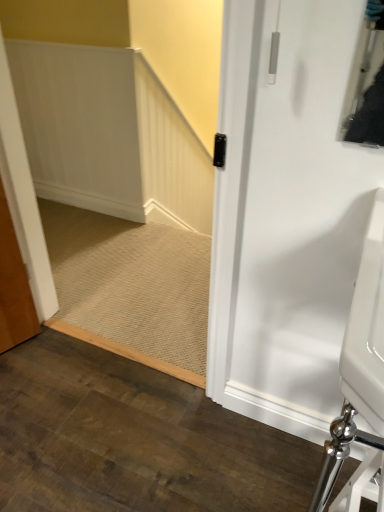
Question: From a real-world perspective, is white glossy sink at lower right under beige carpet at center?

Choices:
 (A) yes
 (B) no

Answer: (B)

Question: Does white glossy sink at lower right have a larger size compared to beige carpet at center?

Choices:
 (A) no
 (B) yes

Answer: (B)

Question: Does white glossy sink at lower right have a greater height compared to beige carpet at center?

Choices:
 (A) yes
 (B) no

Answer: (A)

Question: Is there a large distance between white glossy sink at lower right and beige carpet at center?

Choices:
 (A) no
 (B) yes

Answer: (B)

Question: Does white glossy sink at lower right have a greater width compared to beige carpet at center?

Choices:
 (A) yes
 (B) no

Answer: (B)

Question: From the image's perspective, is white glossy sink at lower right located above beige carpet at center?

Choices:
 (A) no
 (B) yes

Answer: (A)

Question: Is beige carpet at center to the left of white glossy sink at lower right from the viewer's perspective?

Choices:
 (A) no
 (B) yes

Answer: (B)

Question: Is beige carpet at center bigger than white glossy sink at lower right?

Choices:
 (A) no
 (B) yes

Answer: (A)

Question: From the image's perspective, is beige carpet at center on white glossy sink at lower right?

Choices:
 (A) no
 (B) yes

Answer: (B)

Question: Is beige carpet at center closer to the viewer compared to white glossy sink at lower right?

Choices:
 (A) no
 (B) yes

Answer: (A)

Question: From the image's perspective, is beige carpet at center beneath white glossy sink at lower right?

Choices:
 (A) yes
 (B) no

Answer: (B)

Question: Can you confirm if beige carpet at center is wider than white glossy sink at lower right?

Choices:
 (A) no
 (B) yes

Answer: (B)

Question: In terms of width, does beige carpet at center look wider or thinner when compared to white glossy sink at lower right?

Choices:
 (A) wide
 (B) thin

Answer: (A)